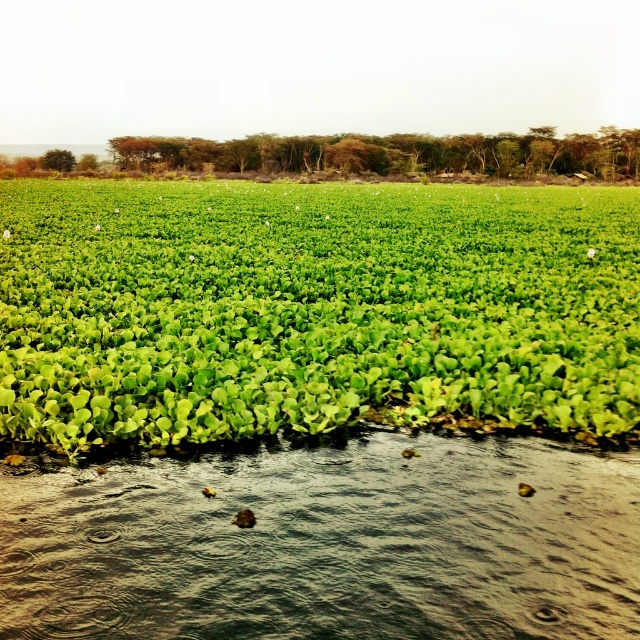
Between green leafy plant at center and green leafy water at lower center, which one appears on the right side from the viewer's perspective?

Positioned to the right is green leafy water at lower center.

Is point (42, 275) positioned in front of point (547, 611)?

No, it is behind (547, 611).

Which is in front, point (99, 188) or point (362, 540)?

Point (362, 540) is in front.

The width and height of the screenshot is (640, 640). I want to click on green leafy plant at center, so click(x=314, y=310).